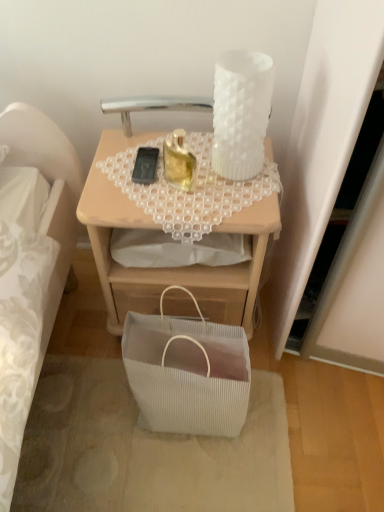
In order to click on free spot behind black matte mobile phone at center in this screenshot , I will do click(151, 140).